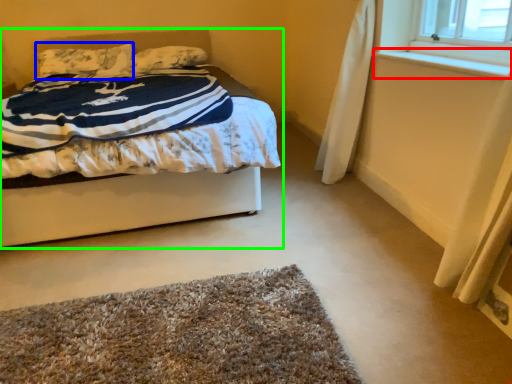
Question: Which object is positioned farthest from window sill (highlighted by a red box)? Select from pillow (highlighted by a blue box) and bed (highlighted by a green box).

Choices:
 (A) pillow
 (B) bed

Answer: (A)